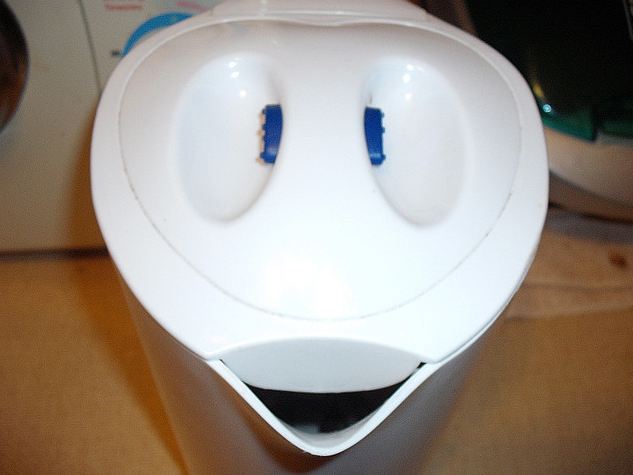
Image resolution: width=633 pixels, height=475 pixels. Find the location of `white pitcher body`. white pitcher body is located at coordinates (192, 387).